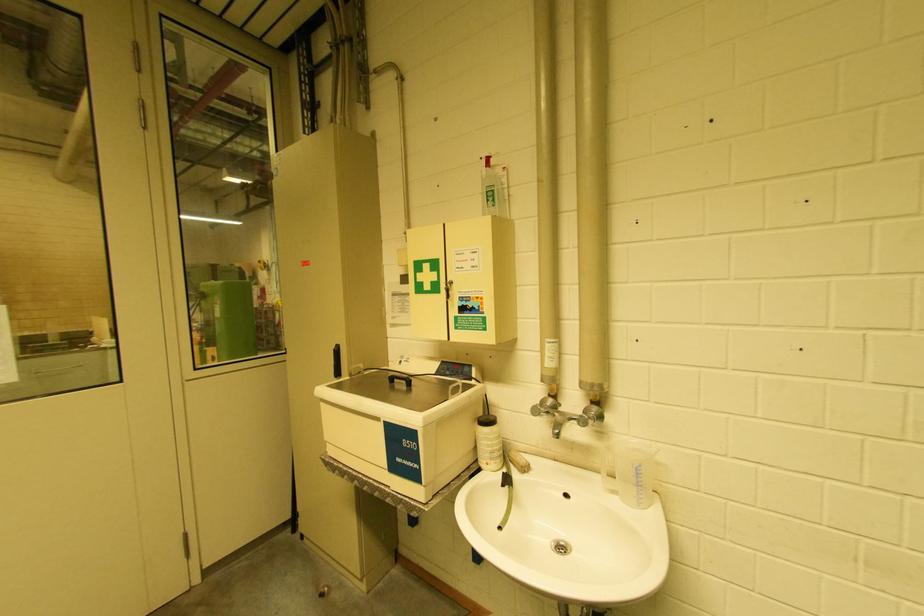
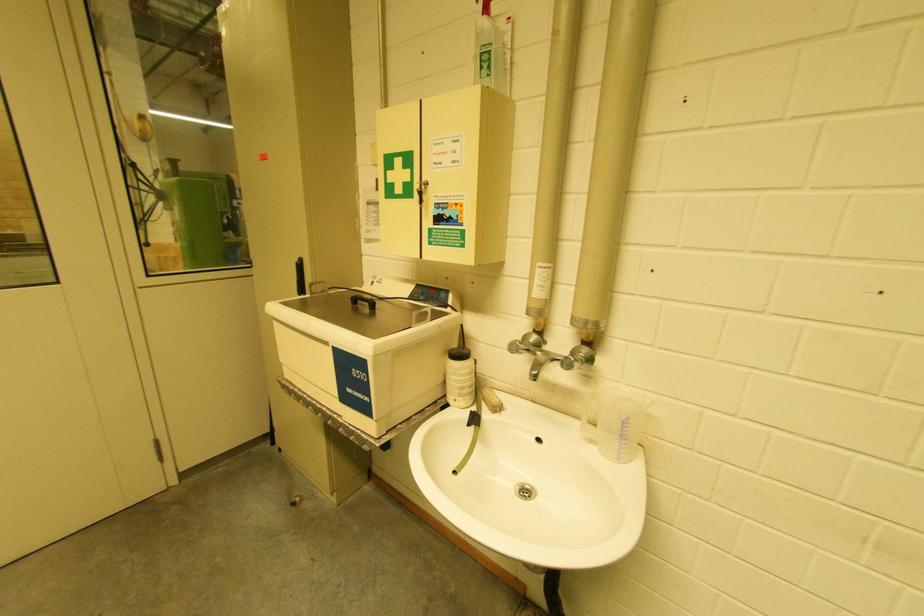
Question: The first image is from the beginning of the video and the second image is from the end. How did the camera likely rotate when shooting the video?

Choices:
 (A) Left
 (B) Right
 (C) Up
 (D) Down

Answer: (D)